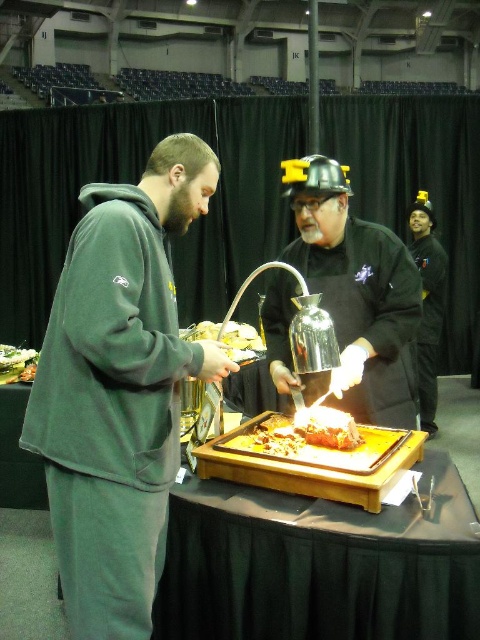
You are standing at the entrance of the event hall and want to find the dark green hoodie at left. According to the coordinates provided, where should you look relative to the center of the image?

The dark green hoodie at left is located at coordinates point 0.609 on the x axis and 0.248 on the y axis, which places it to the right and slightly above the center of the image.

You are a guest at the event and need to locate the shiny silver helmet at center. According to the coordinates provided, where exactly would you find it in the image?

The shiny silver helmet at center is located at coordinates point (357, 291) in the image.

You are a guest at the event and want to place both the shiny silver helmet at center and the black matte helmet at upper right on a shelf that can only hold items up to 10 inches in width. Which helmet should you choose to ensure it fits?

The shiny silver helmet at center might be wider than black matte helmet at upper right, so it is safer to choose the black matte helmet at upper right to ensure it fits on the shelf.